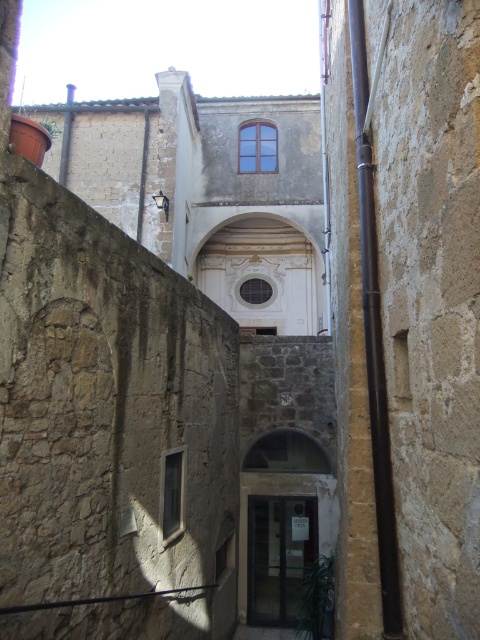
Between white marble archway at center and matte glass door at center, which one is positioned lower?

Positioned lower is matte glass door at center.

At what (x,y) coordinates should I click in order to perform the action: click on white marble archway at center. Please return your answer as a coordinate pair (x, y). The height and width of the screenshot is (640, 480). Looking at the image, I should click on (264, 276).

Is point (223, 307) positioned after point (253, 618)?

Yes.

Locate an element on the screen. This screenshot has height=640, width=480. white marble archway at center is located at coordinates (264, 276).